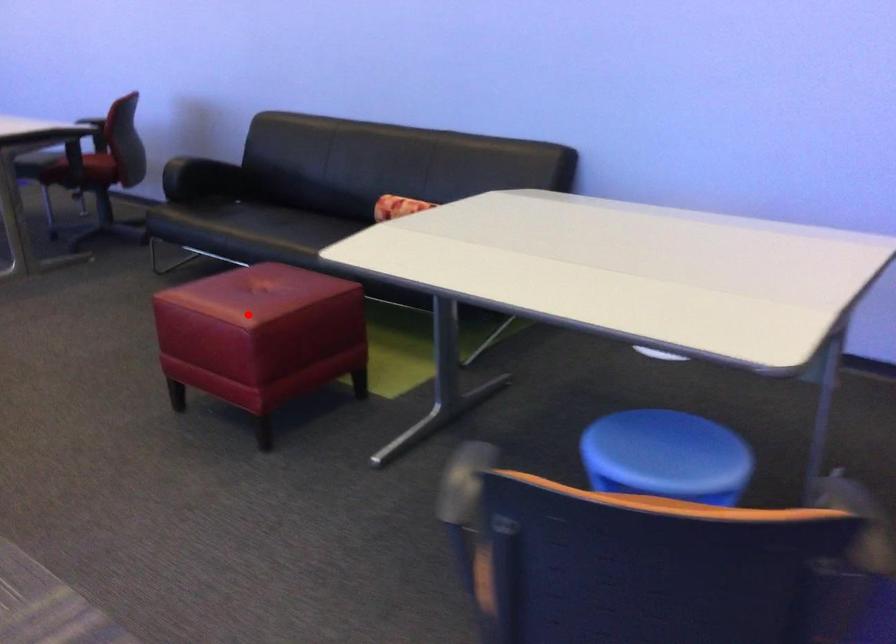
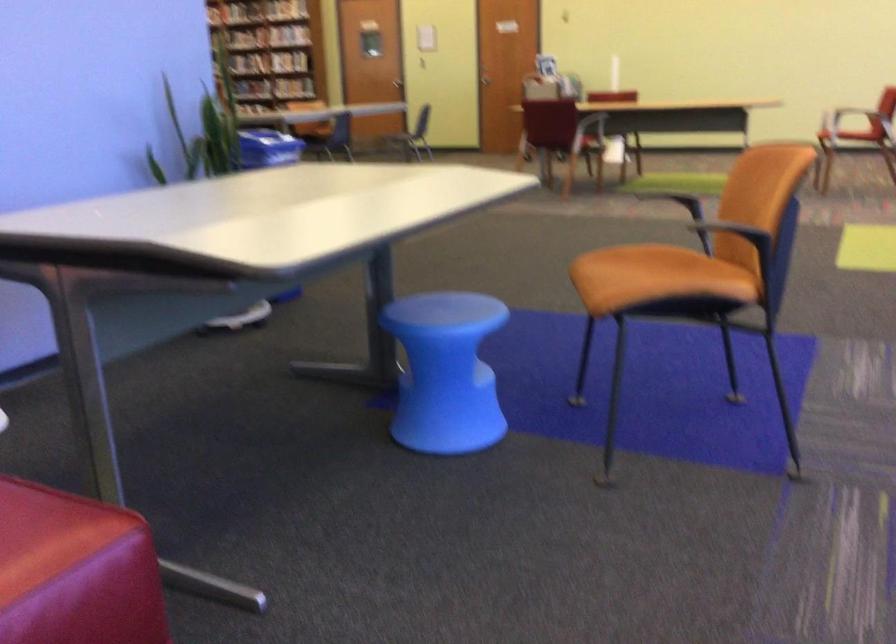
Question: I am providing you with two images of the same scene from different viewpoints. Image1 has a red point marked. In image2, the corresponding 3D location appears at what relative position? Reply with the corresponding letter.

Choices:
 (A) Closer
 (B) Farther

Answer: (A)